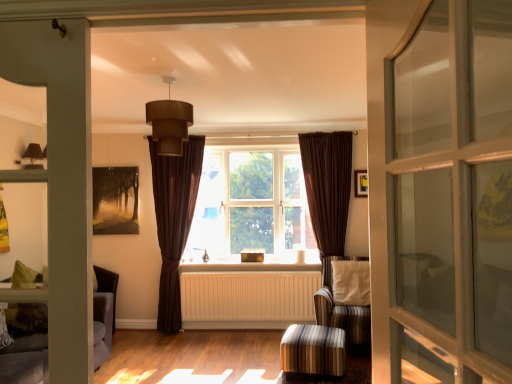
Question: From a real-world perspective, does matte brown lampshade at upper center stand above striped fabric stool at lower center?

Choices:
 (A) yes
 (B) no

Answer: (A)

Question: Does matte brown lampshade at upper center turn towards striped fabric stool at lower center?

Choices:
 (A) no
 (B) yes

Answer: (A)

Question: Can you confirm if matte brown lampshade at upper center is smaller than striped fabric stool at lower center?

Choices:
 (A) yes
 (B) no

Answer: (A)

Question: Is matte brown lampshade at upper center in front of striped fabric stool at lower center?

Choices:
 (A) no
 (B) yes

Answer: (B)

Question: Are matte brown lampshade at upper center and striped fabric stool at lower center making contact?

Choices:
 (A) no
 (B) yes

Answer: (A)

Question: From the image's perspective, is matte brown lampshade at upper center beneath striped fabric stool at lower center?

Choices:
 (A) no
 (B) yes

Answer: (A)

Question: Is striped fabric stool at lower center outside of brown velvet curtain at center, positioned as the first curtain in left-to-right order?

Choices:
 (A) no
 (B) yes

Answer: (B)

Question: Is striped fabric stool at lower center turned away from brown velvet curtain at center, the second curtain positioned from the right?

Choices:
 (A) yes
 (B) no

Answer: (B)

Question: Is striped fabric stool at lower center thinner than brown velvet curtain at center, the second curtain positioned from the right?

Choices:
 (A) yes
 (B) no

Answer: (B)

Question: Does striped fabric stool at lower center contain brown velvet curtain at center, positioned as the first curtain in left-to-right order?

Choices:
 (A) no
 (B) yes

Answer: (A)

Question: Considering the relative sizes of striped fabric stool at lower center and brown velvet curtain at center, positioned as the first curtain in left-to-right order, in the image provided, is striped fabric stool at lower center smaller than brown velvet curtain at center, positioned as the first curtain in left-to-right order,?

Choices:
 (A) no
 (B) yes

Answer: (B)

Question: Can you confirm if striped fabric stool at lower center is positioned to the right of brown velvet curtain at center, the second curtain positioned from the right?

Choices:
 (A) yes
 (B) no

Answer: (A)

Question: Can you confirm if brown fabric curtain at center is wider than striped fabric armchair at center?

Choices:
 (A) yes
 (B) no

Answer: (B)